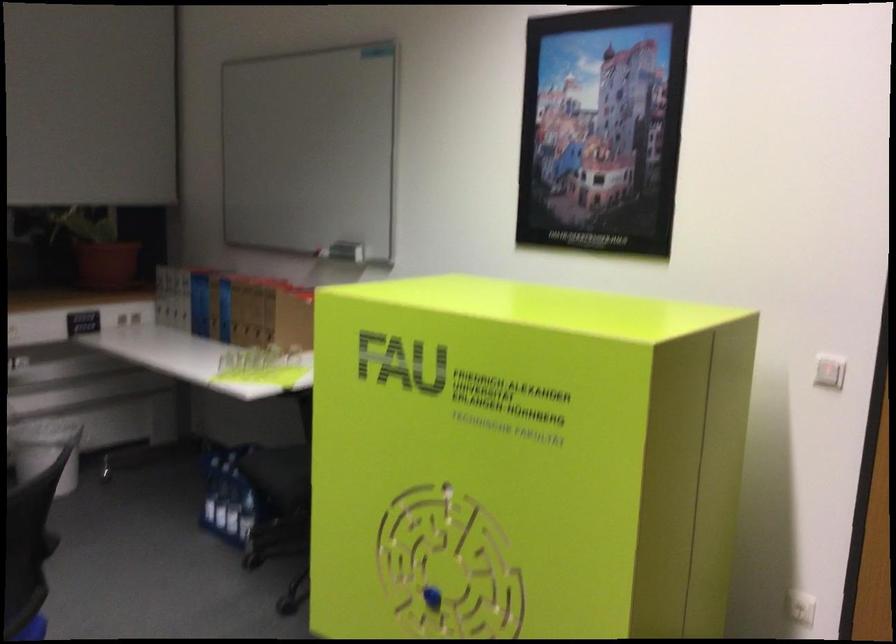
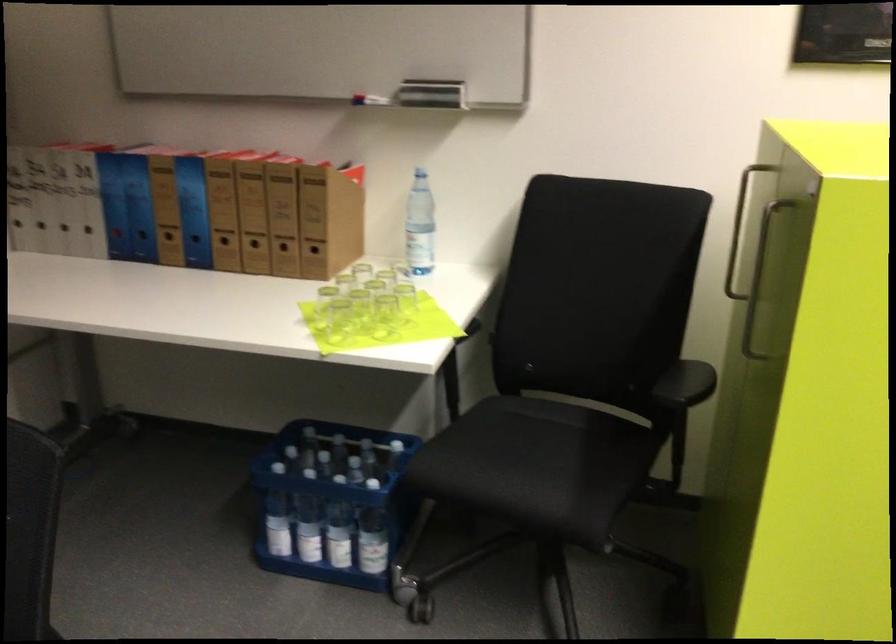
Find the pixel in the second image that matches [239,328] in the first image.

(225, 245)